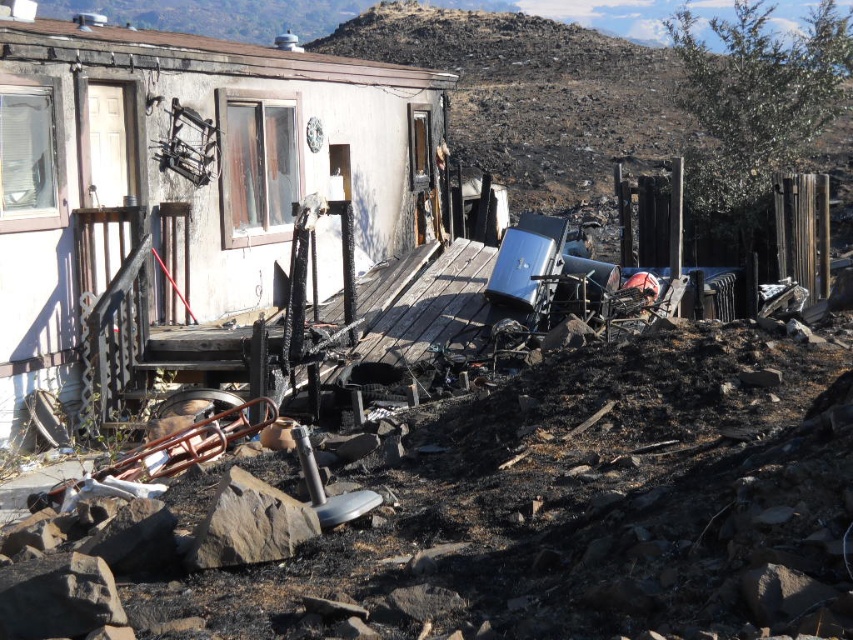
Can you confirm if burnt soil at upper center is taller than brown rough rock at lower center?

Indeed, burnt soil at upper center has a greater height compared to brown rough rock at lower center.

Does burnt soil at upper center have a smaller size compared to brown rough rock at lower center?

Incorrect, burnt soil at upper center is not smaller in size than brown rough rock at lower center.

Who is more distant from viewer, (x=622, y=152) or (x=248, y=534)?

Point (x=622, y=152)

This screenshot has width=853, height=640. What are the coordinates of `burnt soil at upper center` in the screenshot? It's located at (544, 92).